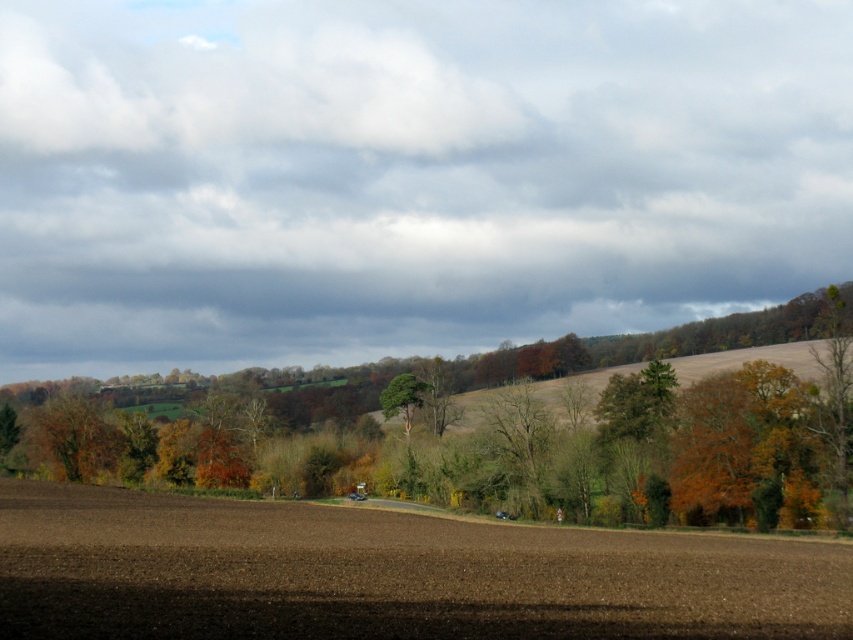
Question: Considering the real-world distances, which object is closest to the brown leafy tree at center?

Choices:
 (A) brown soil at center
 (B) green rough bark tree at center

Answer: (B)

Question: Which of the following is the farthest from the observer?

Choices:
 (A) (254, 538)
 (B) (405, 432)

Answer: (B)

Question: Is the position of brown soil at center more distant than that of brown leafy tree at center?

Choices:
 (A) yes
 (B) no

Answer: (B)

Question: Which object appears farthest from the camera in this image?

Choices:
 (A) green rough bark tree at center
 (B) brown leafy tree at center

Answer: (A)

Question: Can you confirm if brown soil at center is smaller than brown leafy tree at center?

Choices:
 (A) yes
 (B) no

Answer: (A)

Question: Does brown leafy tree at center have a greater width compared to green rough bark tree at center?

Choices:
 (A) no
 (B) yes

Answer: (B)